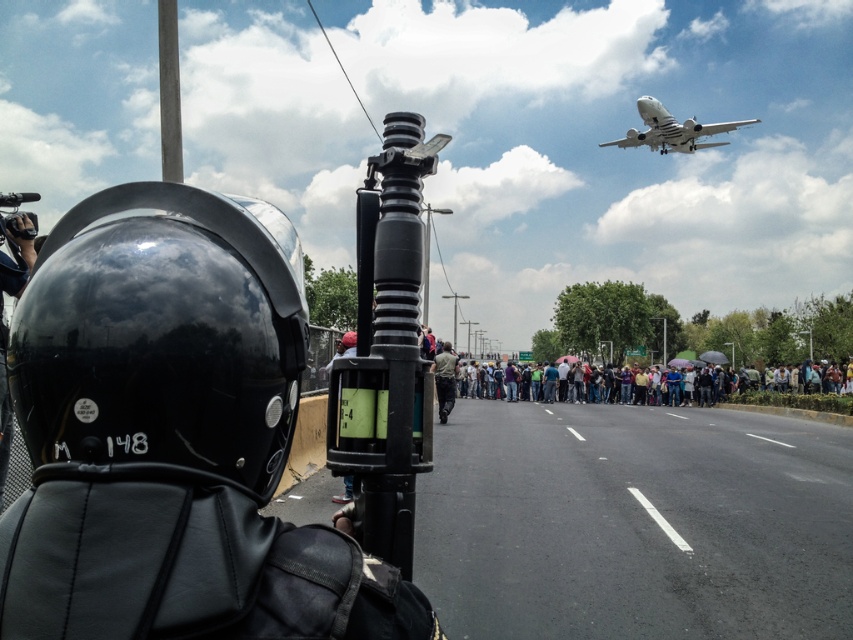
Which is below, white matte airplane at upper center or light brown fabric shirt at center?

light brown fabric shirt at center

Does white matte airplane at upper center appear on the left side of light brown fabric shirt at center?

Incorrect, white matte airplane at upper center is not on the left side of light brown fabric shirt at center.

Who is more distant from viewer, (718, 125) or (444, 419)?

Point (718, 125)

This screenshot has width=853, height=640. In order to click on white matte airplane at upper center in this screenshot , I will do `click(671, 129)`.

Is point (242, 477) positioned in front of point (722, 141)?

Yes.

Which is more to the left, matte black helmet at left or white matte airplane at upper center?

matte black helmet at left is more to the left.

Does point (136, 243) lie behind point (706, 145)?

That is False.

Find the location of a particular element. Image resolution: width=853 pixels, height=640 pixels. matte black helmet at left is located at coordinates (173, 435).

Is matte black helmet at left further to camera compared to light brown fabric shirt at center?

No.

Who is more forward, (16, 310) or (431, 365)?

Point (16, 310)

I want to click on matte black helmet at left, so click(173, 435).

The width and height of the screenshot is (853, 640). Identify the location of matte black helmet at left. (173, 435).